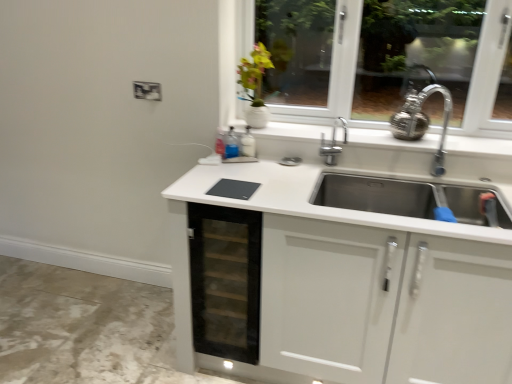
Question: From the image's perspective, relative to green matte vase at upper center, is transparent glass drawer at center above or below?

Choices:
 (A) above
 (B) below

Answer: (B)

Question: Would you say transparent glass drawer at center is to the left or to the right of green matte vase at upper center in the picture?

Choices:
 (A) left
 (B) right

Answer: (A)

Question: Considering the positions of transparent glass drawer at center and green matte vase at upper center in the image, is transparent glass drawer at center wider or thinner than green matte vase at upper center?

Choices:
 (A) wide
 (B) thin

Answer: (A)

Question: Is point (259, 102) positioned closer to the camera than point (189, 213)?

Choices:
 (A) farther
 (B) closer

Answer: (A)

Question: From a real-world perspective, is green matte vase at upper center above or below transparent glass drawer at center?

Choices:
 (A) above
 (B) below

Answer: (A)

Question: Do you think green matte vase at upper center is within transparent glass drawer at center, or outside of it?

Choices:
 (A) inside
 (B) outside

Answer: (B)

Question: From the image's perspective, is green matte vase at upper center above or below transparent glass drawer at center?

Choices:
 (A) below
 (B) above

Answer: (B)